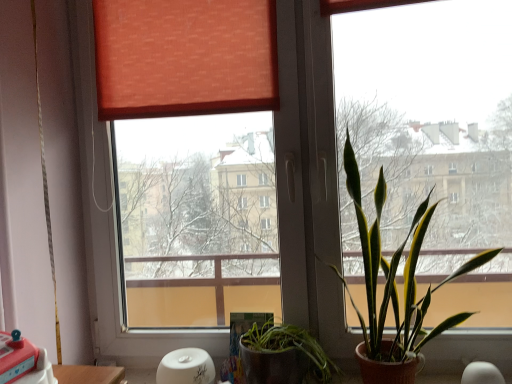
Question: Is green leafy plant at right wider or thinner than wooden table at lower left?

Choices:
 (A) thin
 (B) wide

Answer: (B)

Question: Choose the correct answer: Is green leafy plant at right inside wooden table at lower left or outside it?

Choices:
 (A) outside
 (B) inside

Answer: (A)

Question: Is green leafy plant at right taller or shorter than wooden table at lower left?

Choices:
 (A) tall
 (B) short

Answer: (A)

Question: Relative to green leafy plant at right, is wooden table at lower left in front or behind?

Choices:
 (A) front
 (B) behind

Answer: (B)

Question: From a real-world perspective, is wooden table at lower left positioned above or below green leafy plant at right?

Choices:
 (A) below
 (B) above

Answer: (A)

Question: From the image's perspective, relative to green leafy plant at right, is wooden table at lower left above or below?

Choices:
 (A) above
 (B) below

Answer: (B)

Question: Considering the positions of wooden table at lower left and green leafy plant at right in the image, is wooden table at lower left bigger or smaller than green leafy plant at right?

Choices:
 (A) small
 (B) big

Answer: (A)